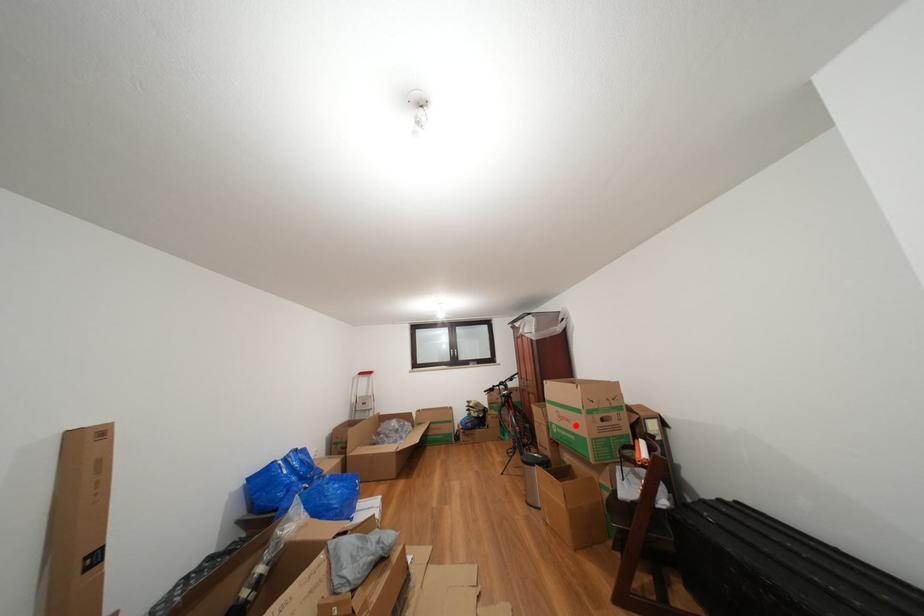
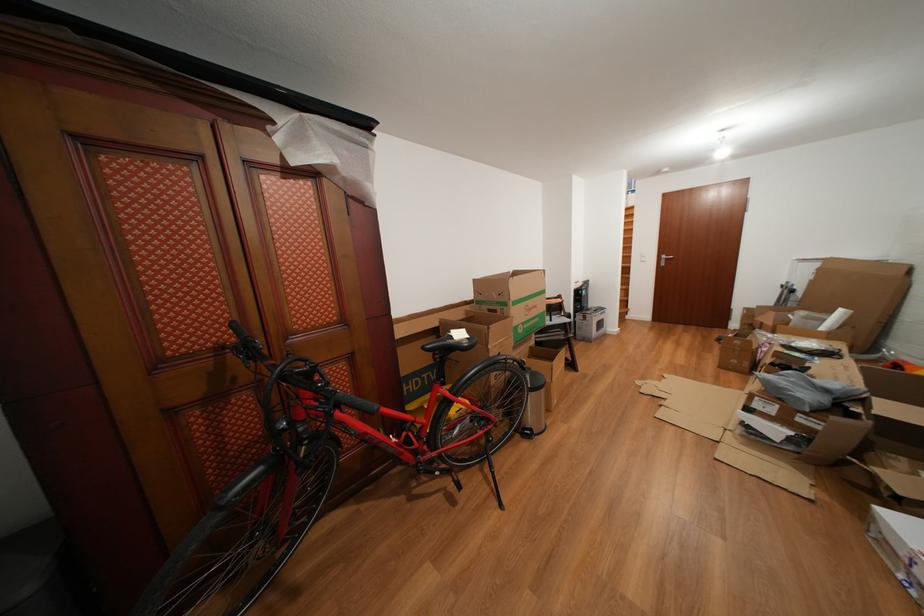
Question: I am providing you with two images of the same scene from different viewpoints. A red point is shown in image1. For the corresponding object point in image2, is it positioned nearer or farther from the camera?

Choices:
 (A) Nearer
 (B) Farther

Answer: (A)